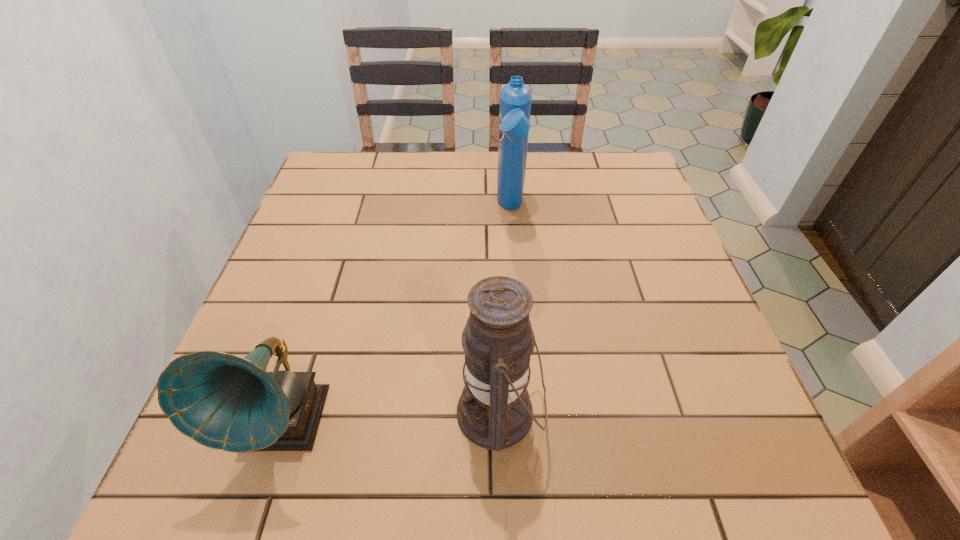
You are a GUI agent. You are given a task and a screenshot of the screen. Output one action in this format:
    pyautogui.click(x=<x>, y=<y>)
    Task: Click on the shampoo
    
    Given the screenshot: What is the action you would take?
    pyautogui.click(x=515, y=98)

Identify the location of oil lamp. The height and width of the screenshot is (540, 960). (494, 411).

This screenshot has width=960, height=540. Identify the location of the leftmost object. (222, 401).

Find the location of a particular element. This screenshot has width=960, height=540. the shortest object is located at coordinates (222, 401).

Where is `vacant space located on the front of the shampoo`? vacant space located on the front of the shampoo is located at coordinates tap(522, 366).

Image resolution: width=960 pixels, height=540 pixels. Identify the location of free location located on the right of the oil lamp. (653, 413).

The image size is (960, 540). I want to click on object that is positioned at the far edge, so click(515, 98).

Where is `oil lamp located at the near edge`? oil lamp located at the near edge is located at coordinates (494, 411).

Locate an element on the screen. Image resolution: width=960 pixels, height=540 pixels. phonograph_record situated at the near edge is located at coordinates (222, 401).

Find the location of `object located in the left edge section of the desktop`. object located in the left edge section of the desktop is located at coordinates (222, 401).